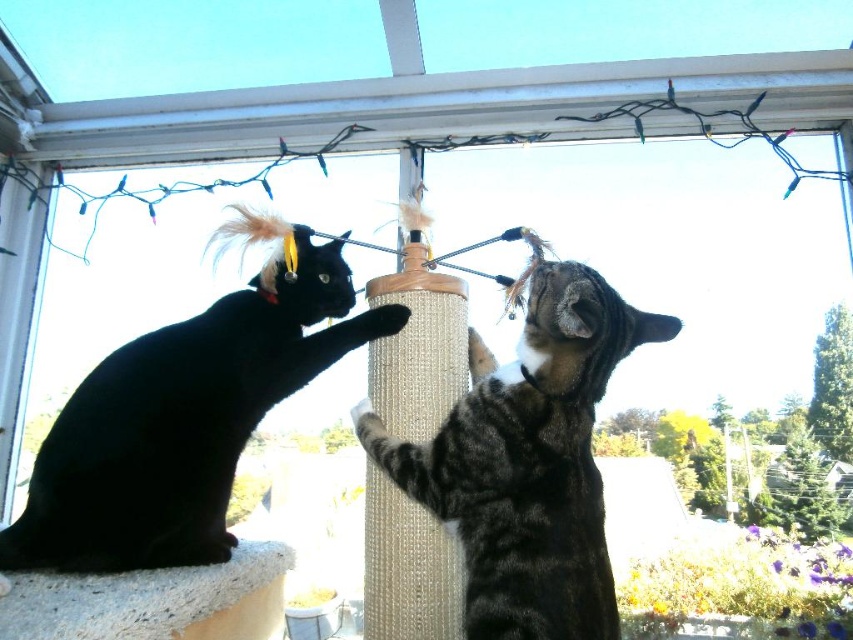
You are a cat owner who wants to place a new cat tree in the balcony. You have a cat tree that is 2 meters wide. Based on the image, will it fit between the tabby fur cat at center and the white textured window sill at lower left?

The tabby fur cat at center might be wider than the white textured window sill at lower left, so the cat tree that is 2 meters wide may not fit between them.

You are standing on the balcony where the two cats are playing. You need to place a new toy between the two points marked as point (202, 310) and point (556, 616). Which point should the toy be closer to so that it is positioned in front of the black cat on the left?

The toy should be placed closer to point (556, 616) because point (202, 310) is behind point (556, 616), meaning that placing the toy near the front point would position it in front of the black cat on the left.